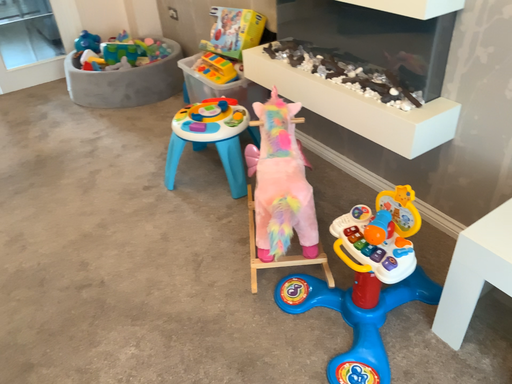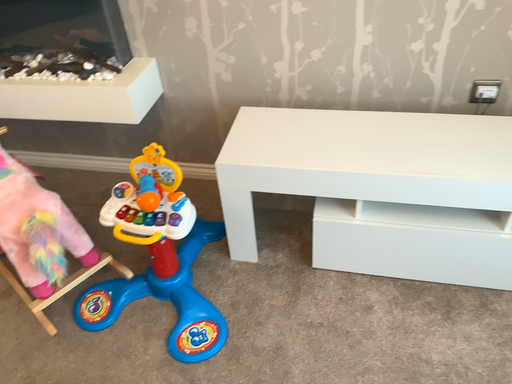
Question: Which way did the camera rotate in the video?

Choices:
 (A) rotated downward
 (B) rotated upward

Answer: (B)